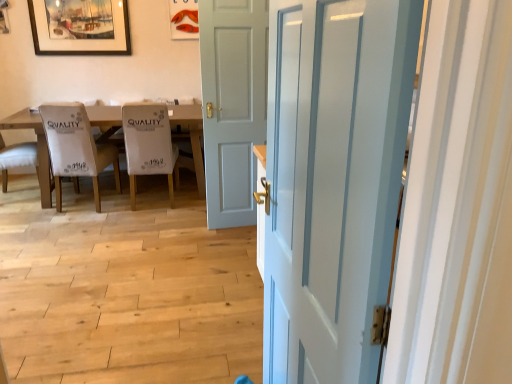
Where is `unoccupied area in front of light gray wood door at center, marked as the 1th door in a left-to-right arrangement`? Image resolution: width=512 pixels, height=384 pixels. unoccupied area in front of light gray wood door at center, marked as the 1th door in a left-to-right arrangement is located at coordinates (230, 233).